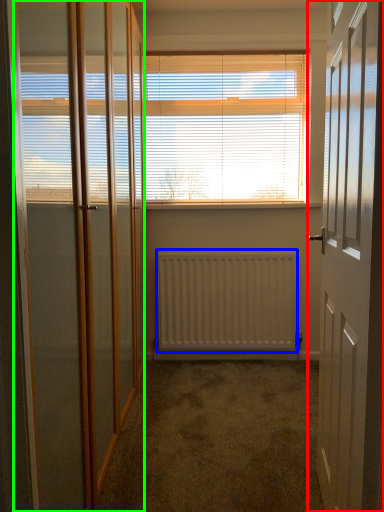
Question: Considering the real-world distances, which object is farthest from door (highlighted by a red box)? radiator (highlighted by a blue box) or screen door (highlighted by a green box)?

Choices:
 (A) radiator
 (B) screen door

Answer: (A)